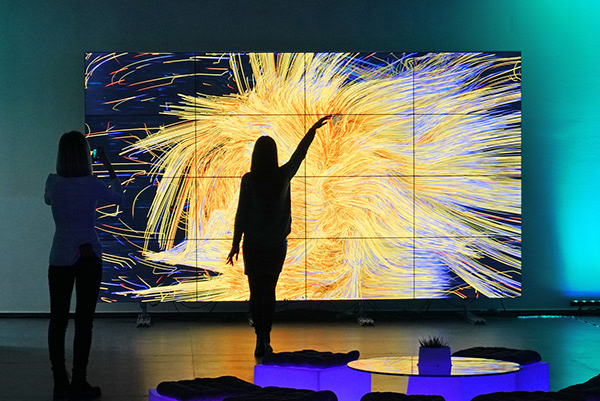
Locate an element on the screen. The image size is (600, 401). floor is located at coordinates (165, 349).